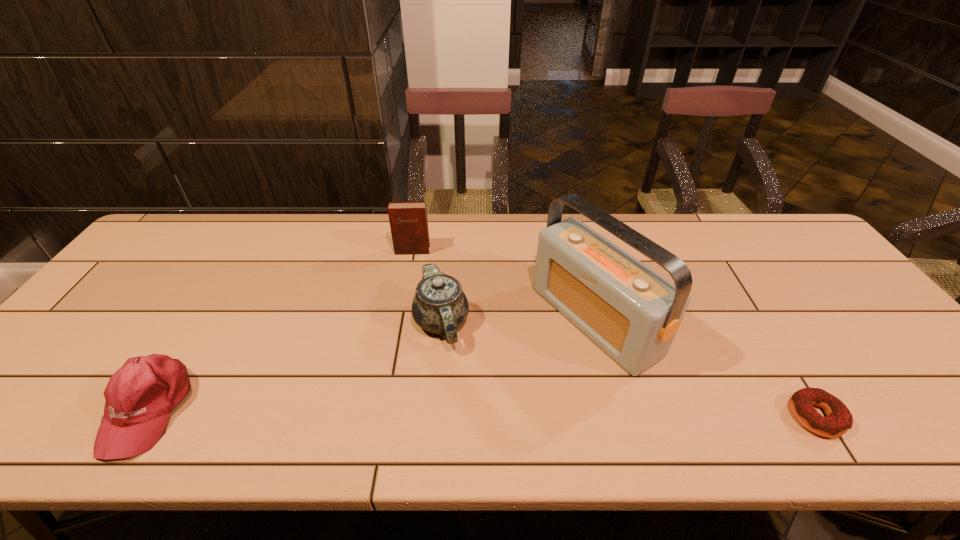
Identify the location of vacant area that lies between the leftmost object and the chinaware. The width and height of the screenshot is (960, 540). (295, 366).

You are a GUI agent. You are given a task and a screenshot of the screen. Output one action in this format:
    pyautogui.click(x=<x>, y=<y>)
    Task: Click on the free space that is in between the rightmost object and the leftmost object
    
    Given the screenshot: What is the action you would take?
    (482, 413)

Locate an element on the screen. Image resolution: width=960 pixels, height=540 pixels. free space between the chinaware and the second object from right to left is located at coordinates (517, 321).

Find the location of a particular element. empty location between the chinaware and the radio receiver is located at coordinates (517, 321).

Identify the location of free space between the radio receiver and the fourth tallest object. (372, 364).

This screenshot has height=540, width=960. Identify the location of unoccupied position between the radio receiver and the fourth tallest object. (372, 364).

Point out which object is positioned as the fourth nearest to the tallest object. Please provide its 2D coordinates. Your answer should be formatted as a tuple, i.e. [(x, y)], where the tuple contains the x and y coordinates of a point satisfying the conditions above.

[(140, 396)]

Where is `the fourth closest object to the leftmost object`? the fourth closest object to the leftmost object is located at coordinates (839, 419).

This screenshot has width=960, height=540. Find the location of `vacant area that satisfies the following two spatial constraints: 1. at the front of the fourth tallest object with the brim; 2. on the left side of the rightmost object`. vacant area that satisfies the following two spatial constraints: 1. at the front of the fourth tallest object with the brim; 2. on the left side of the rightmost object is located at coordinates (144, 417).

You are a GUI agent. You are given a task and a screenshot of the screen. Output one action in this format:
    pyautogui.click(x=<x>, y=<y>)
    Task: Click on the vacant space that satisfies the following two spatial constraints: 1. on the back side of the chinaware; 2. on the right side of the radio receiver
    This screenshot has height=540, width=960.
    Given the screenshot: What is the action you would take?
    pyautogui.click(x=442, y=320)